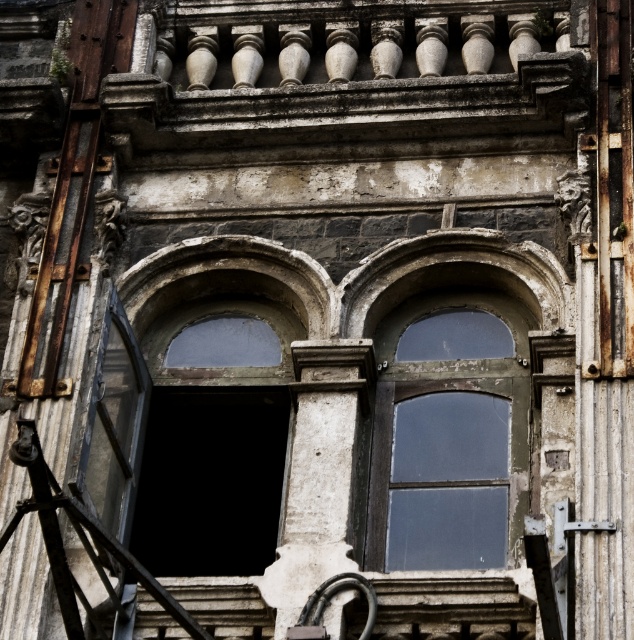
Question: Does white stone balustrade at upper center have a smaller size compared to transparent glass window at center?

Choices:
 (A) yes
 (B) no

Answer: (B)

Question: Which of the following is the farthest from the observer?

Choices:
 (A) transparent glass window at center
 (B) white stone balustrade at upper center

Answer: (B)

Question: Which of the following is the closest to the observer?

Choices:
 (A) (493, 452)
 (B) (112, 88)

Answer: (A)

Question: Is white stone balustrade at upper center positioned before transparent glass window at center?

Choices:
 (A) yes
 (B) no

Answer: (B)

Question: Which of the following is the farthest from the observer?

Choices:
 (A) transparent glass window at center
 (B) white stone balustrade at upper center

Answer: (B)

Question: Does white stone balustrade at upper center lie behind transparent glass window at center?

Choices:
 (A) no
 (B) yes

Answer: (B)